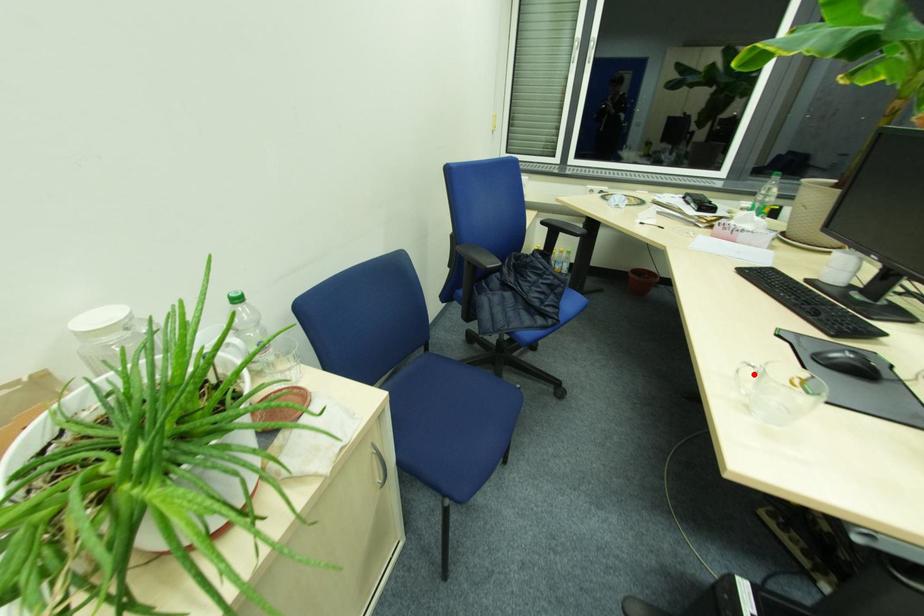
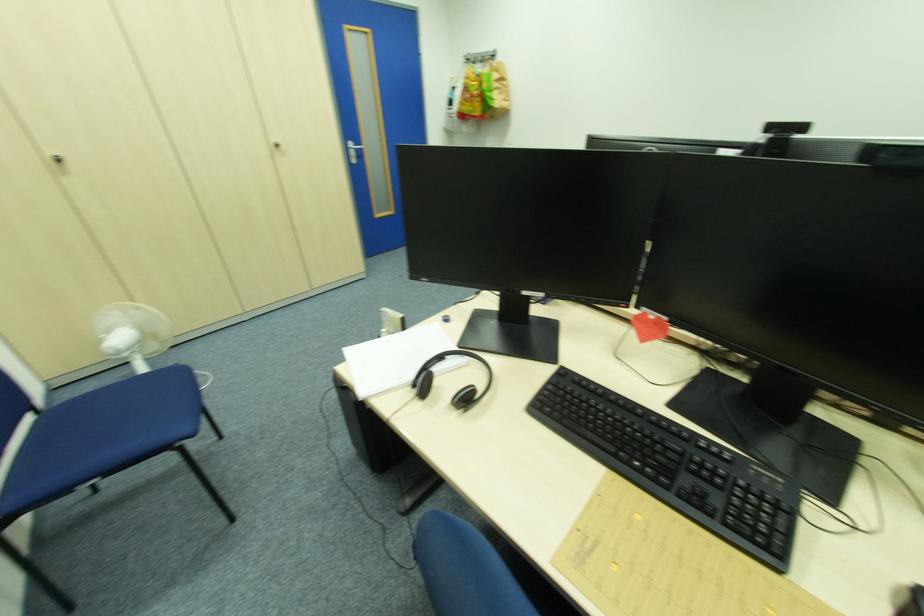
Question: I am providing you with two images of the same scene from different viewpoints. A red point is marked on the first image. Can you still see the location of the red point in image 2?

Choices:
 (A) Yes
 (B) No

Answer: (B)